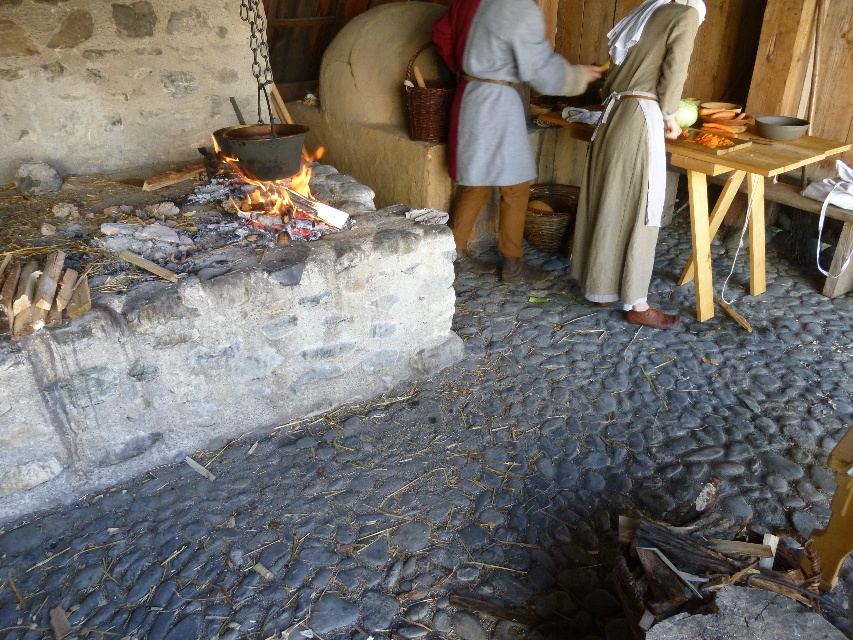
Question: Which point is farther to the camera?

Choices:
 (A) gray woolen robe at center
 (B) light brown linen robe at center

Answer: (A)

Question: Is light brown linen robe at center further to camera compared to gray woolen robe at center?

Choices:
 (A) no
 (B) yes

Answer: (A)

Question: Which object appears closest to the camera in this image?

Choices:
 (A) gray woolen robe at center
 (B) light brown linen robe at center

Answer: (B)

Question: Is light brown linen robe at center to the left of gray woolen robe at center from the viewer's perspective?

Choices:
 (A) yes
 (B) no

Answer: (B)

Question: Does light brown linen robe at center appear on the left side of gray woolen robe at center?

Choices:
 (A) yes
 (B) no

Answer: (B)

Question: Which point appears farthest from the camera in this image?

Choices:
 (A) (515, 124)
 (B) (587, 220)

Answer: (A)